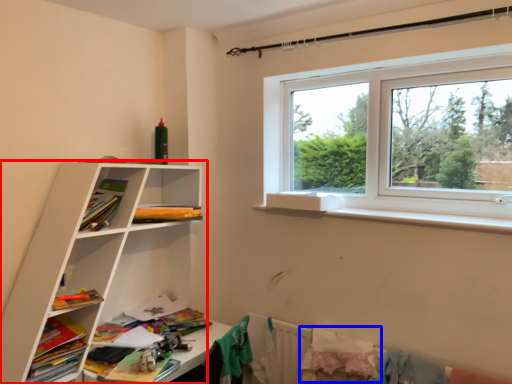
Question: Which object is further to the camera taking this photo, shelf (highlighted by a red box) or clothing (highlighted by a blue box)?

Choices:
 (A) shelf
 (B) clothing

Answer: (B)